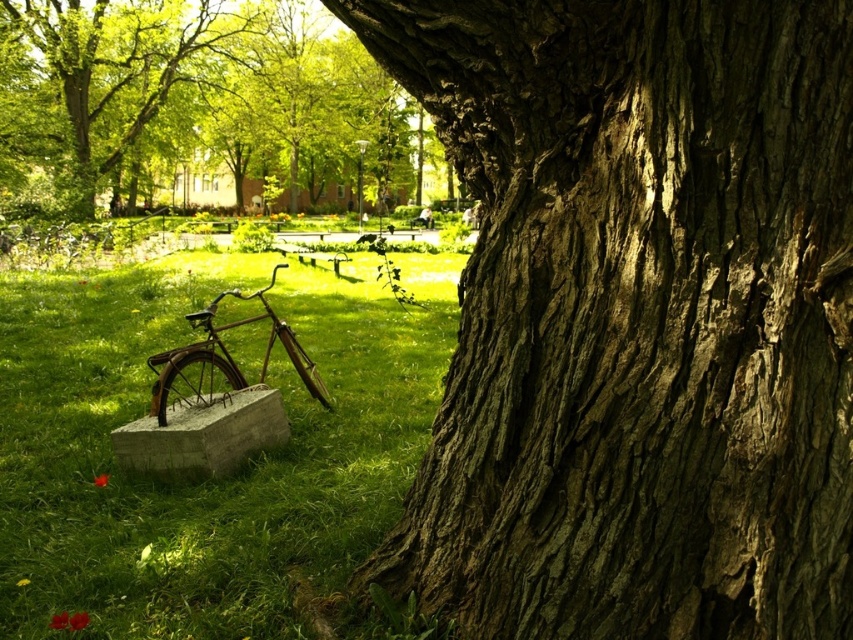
Is green grass at lower left further to camera compared to rusty metal bicycle at lower left?

No, green grass at lower left is in front of rusty metal bicycle at lower left.

Between point (33, 332) and point (242, 376), which one is positioned behind?

The point (33, 332) is more distant.

In order to click on green grass at lower left in this screenshot , I will do `click(196, 477)`.

Which is in front, point (796, 524) or point (206, 316)?

Positioned in front is point (796, 524).

Does rough bark tree trunk at center have a smaller size compared to rusty metal bicycle at lower left?

Incorrect, rough bark tree trunk at center is not smaller in size than rusty metal bicycle at lower left.

Does point (548, 324) come behind point (311, 362)?

No, it is not.

The height and width of the screenshot is (640, 853). Find the location of `rough bark tree trunk at center`. rough bark tree trunk at center is located at coordinates (637, 317).

Does green grass at lower left have a larger size compared to smooth bark tree at center?

Actually, green grass at lower left might be smaller than smooth bark tree at center.

Who is higher up, green grass at lower left or smooth bark tree at center?

smooth bark tree at center

Does point (334, 296) come farther from viewer compared to point (251, 83)?

No, (334, 296) is in front of (251, 83).

I want to click on green grass at lower left, so point(196,477).